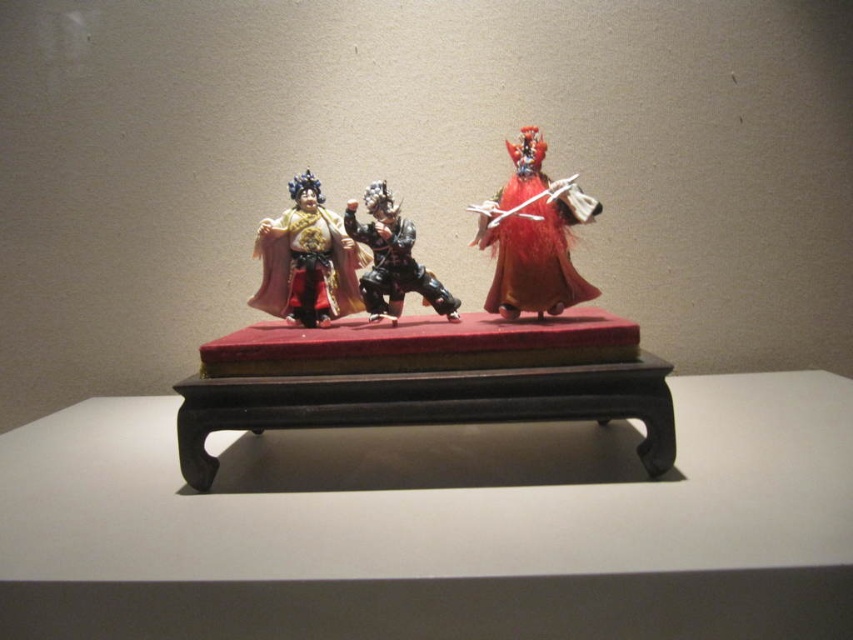
Looking at this image, you are standing in front of the display and want to touch the wooden table at center and the matte gold fabric at center. Which object will your hand reach first?

The wooden table at center is closer to the viewer than the matte gold fabric at center, so your hand will reach the wooden table at center first.

You are a visitor observing the three figurines on the rectangular red platform. You notice two points marked on the platform. The first point is at coordinates point [554,296] and the second point is at point [300,262]. Which point is closer to you as you face the platform?

Point [554,296] is in front of point [300,262], so the first point is closer to you as you face the platform.